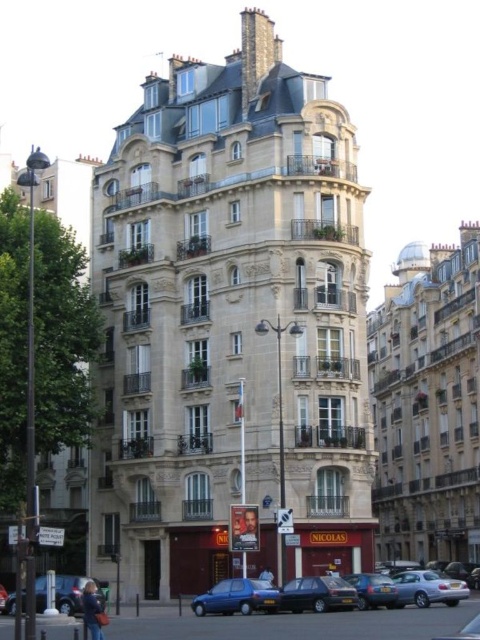
Question: From the image, what is the correct spatial relationship of shiny black sedan at center in relation to blue metallic car at lower left?

Choices:
 (A) above
 (B) below

Answer: (A)

Question: In this image, where is blue metallic car at lower left located relative to smooth brown hair at center?

Choices:
 (A) left
 (B) right

Answer: (A)

Question: Which object appears farthest from the camera in this image?

Choices:
 (A) metallic blue hatchback at lower center
 (B) shiny black sedan at center

Answer: (A)

Question: Which of the following is the closest to the observer?

Choices:
 (A) metallic silver car at lower right
 (B) shiny black sedan at center

Answer: (A)

Question: Which point is closer to the camera?

Choices:
 (A) (241, 518)
 (B) (272, 579)
 (C) (104, 593)
 (D) (248, 611)

Answer: (D)

Question: Can you confirm if shiny black sedan at center is positioned to the right of blue metallic car at lower left?

Choices:
 (A) yes
 (B) no

Answer: (A)